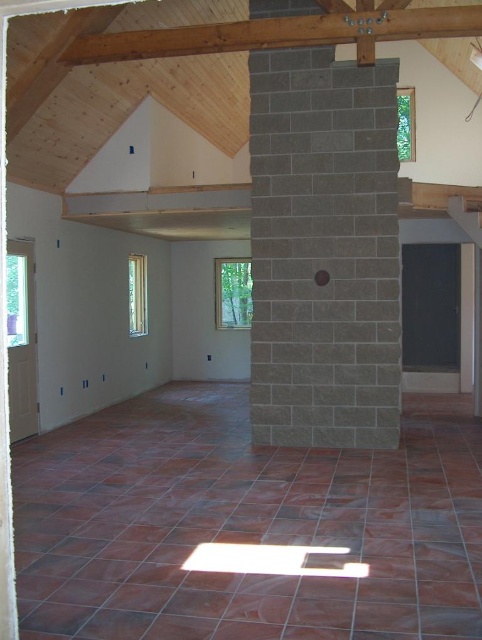
You are an architect designing a renovation plan for this space. You need to install a new light fixture that must be placed above the gray stone pillar at center. However, there is a brown wooden beam at upper center in the way. Can the light fixture be positioned directly above the pillar without interfering with the beam?

The gray stone pillar at center is located below the brown wooden beam at upper center, so the light fixture cannot be placed directly above the pillar without hitting the beam.